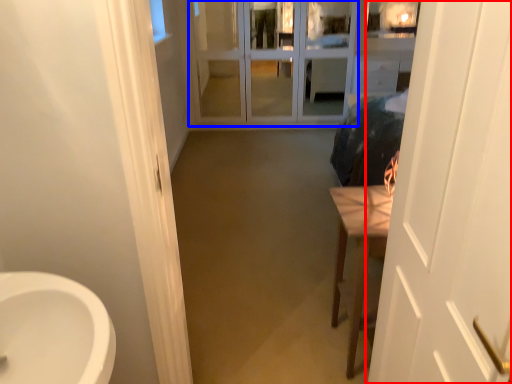
Question: Which object is closer to the camera taking this photo, door (highlighted by a red box) or screen door (highlighted by a blue box)?

Choices:
 (A) door
 (B) screen door

Answer: (A)